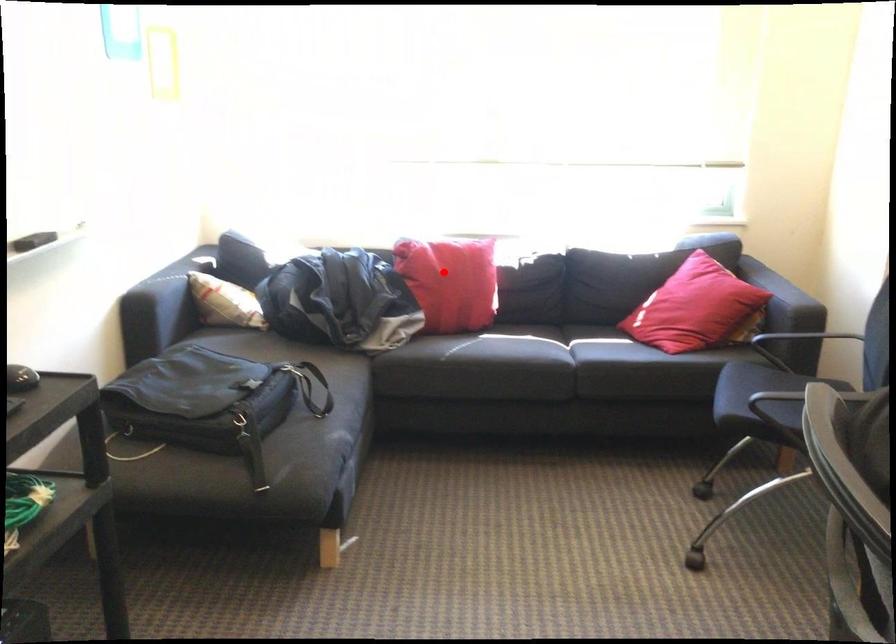
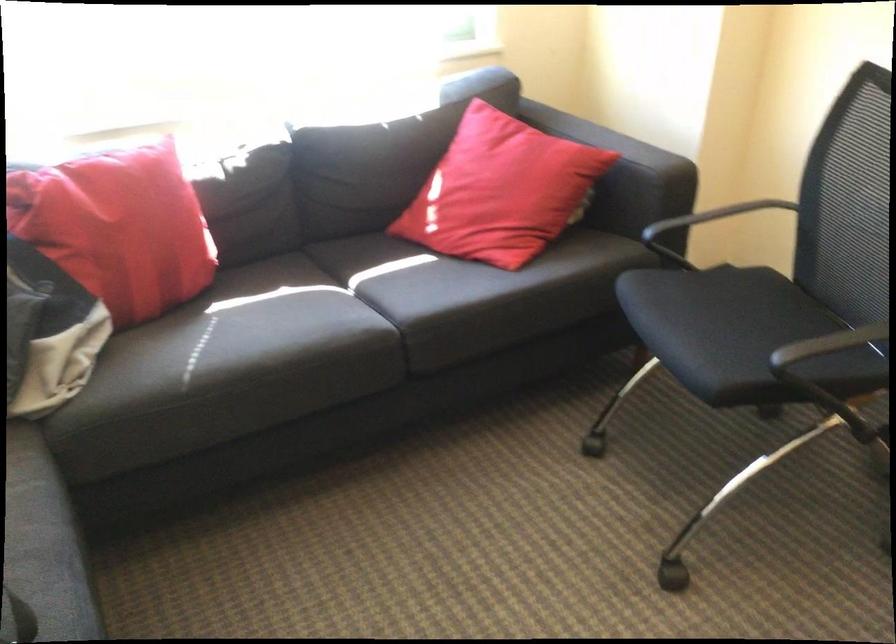
Locate, in the second image, the point that corresponds to the highlighted location in the first image.

(117, 228)